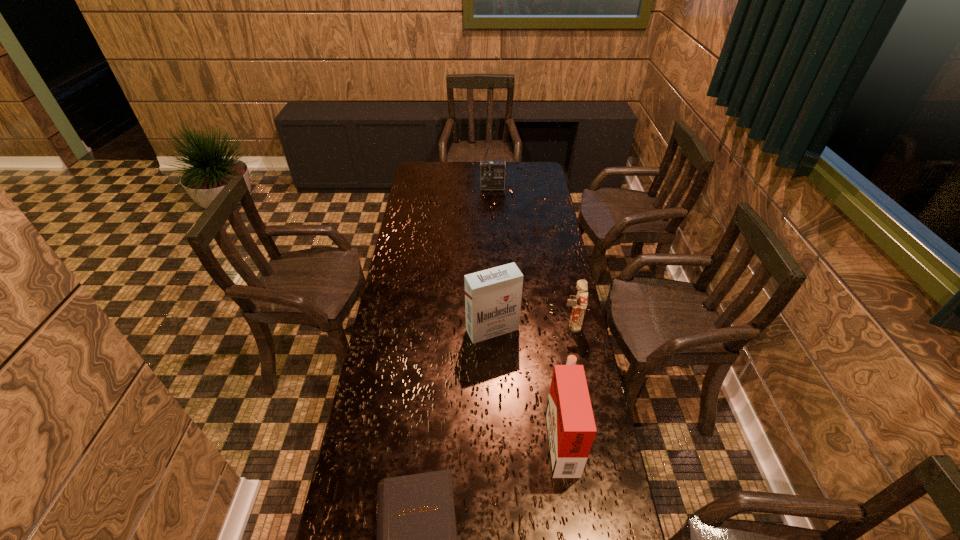
Identify the location of free region located 0.330m on the front-facing side of the rightmost object. (474, 326).

Where is `vacant area located 0.200m on the front-facing side of the rightmost object`? vacant area located 0.200m on the front-facing side of the rightmost object is located at coordinates (509, 326).

You are a GUI agent. You are given a task and a screenshot of the screen. Output one action in this format:
    pyautogui.click(x=<x>, y=<y>)
    Task: Click on the vacant space situated 0.080m on the front-facing side of the rightmost object
    The image size is (960, 540).
    Given the screenshot: What is the action you would take?
    pyautogui.click(x=540, y=326)

Locate an element on the screen. cigarette case present at the right edge is located at coordinates (571, 429).

Identify the location of figurine that is positioned at the right edge. Image resolution: width=960 pixels, height=540 pixels. (579, 302).

At what (x,y) coordinates should I click in order to perform the action: click on vacant space at the far edge of the desktop. Please return your answer as a coordinate pair (x, y). The height and width of the screenshot is (540, 960). Looking at the image, I should click on (463, 171).

This screenshot has width=960, height=540. Identify the location of free space at the left edge. (389, 438).

In the image, there is a desktop. Identify the location of vacant region at the right edge. (546, 209).

In the image, there is a desktop. At what (x,y) coordinates should I click in order to perform the action: click on free region at the far right corner. Please return your answer as a coordinate pair (x, y). Looking at the image, I should click on (523, 169).

Image resolution: width=960 pixels, height=540 pixels. I want to click on blank region between the second nearest object and the radio receiver, so click(x=527, y=312).